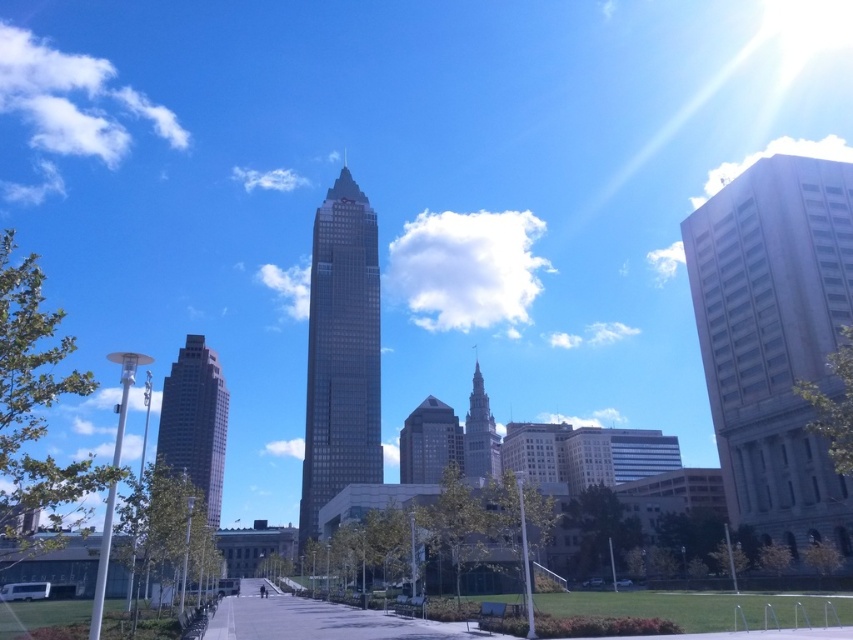
Question: Is beige concrete building at right above gray concrete pavement at center?

Choices:
 (A) no
 (B) yes

Answer: (B)

Question: Is dark brown glass skyscraper at center below silver glass tower at center?

Choices:
 (A) no
 (B) yes

Answer: (A)

Question: Is dark gray glass skyscraper at center-left further to the viewer compared to matte glass skyscraper at center?

Choices:
 (A) no
 (B) yes

Answer: (B)

Question: Which is farther from the silver glass tower at center?

Choices:
 (A) beige concrete building at right
 (B) gray concrete pavement at center

Answer: (B)

Question: Among these objects, which one is farthest from the camera?

Choices:
 (A) silver glass tower at center
 (B) gray concrete pavement at center
 (C) beige concrete building at right

Answer: (A)

Question: Which point appears closest to the camera in this image?

Choices:
 (A) (350, 432)
 (B) (184, 458)
 (C) (485, 429)

Answer: (A)